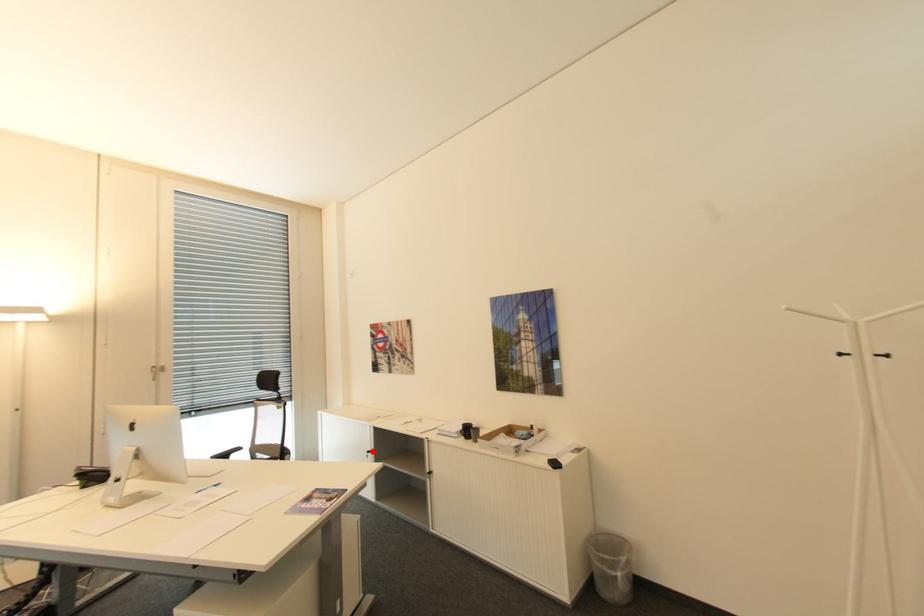
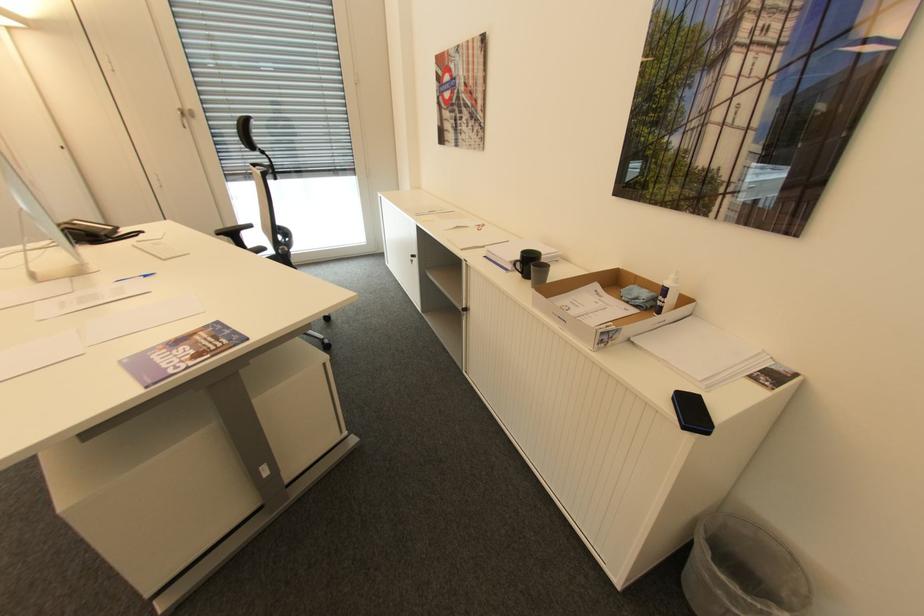
The point at the highlighted location is marked in the first image. Where is the corresponding point in the second image?

(418, 256)